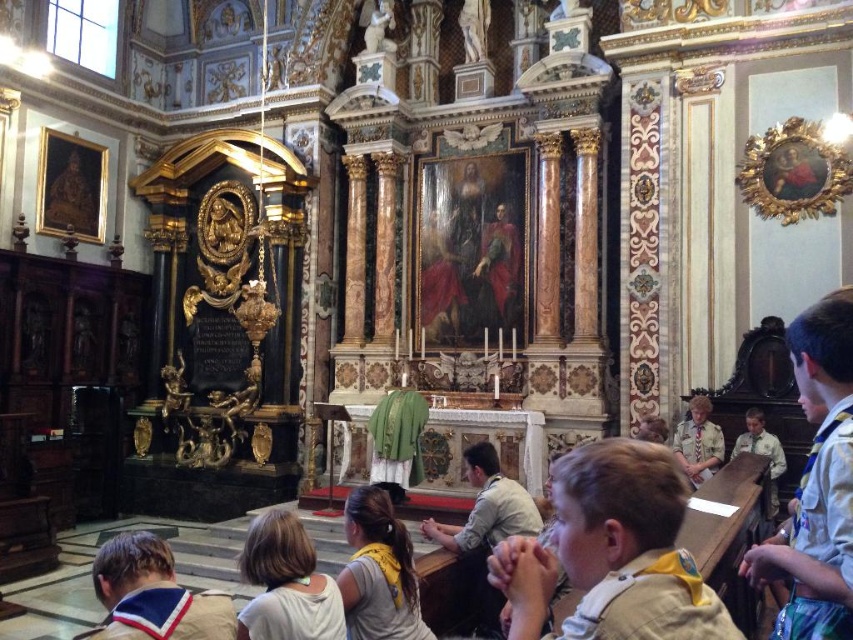
How far apart are gray fabric shirt at center and khaki uniform at lower right?

The distance of gray fabric shirt at center from khaki uniform at lower right is 23.12 meters.

Describe the element at coordinates (378, 572) in the screenshot. I see `gray fabric shirt at center` at that location.

Which is in front, point (379, 618) or point (698, 403)?

Positioned in front is point (379, 618).

Image resolution: width=853 pixels, height=640 pixels. Find the location of `gray fabric shirt at center`. gray fabric shirt at center is located at coordinates (378, 572).

From the picture: Measure the distance from light brown uniform at center to gray fabric shirt at center.

They are 7.12 meters apart.

From the picture: Is light brown uniform at center further to the viewer compared to gray fabric shirt at center?

No.

Between point (567, 452) and point (374, 508), which one is positioned in front?

Positioned in front is point (374, 508).

Identify the location of light brown uniform at center. This screenshot has width=853, height=640. (613, 552).

Who is more distant from viewer, (622, 560) or (717, 449)?

The point (717, 449) is behind.

This screenshot has height=640, width=853. What are the coordinates of `light brown uniform at center` in the screenshot? It's located at (613, 552).

Between point (601, 580) and point (704, 460), which one is positioned behind?

The point (704, 460) is behind.

You are a GUI agent. You are given a task and a screenshot of the screen. Output one action in this format:
    pyautogui.click(x=<x>, y=<y>)
    Task: Click on the light brown uniform at center
    
    Given the screenshot: What is the action you would take?
    pyautogui.click(x=613, y=552)